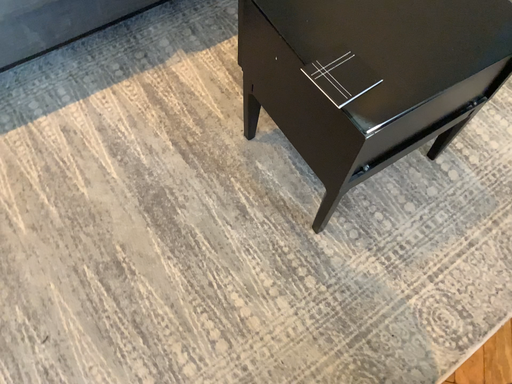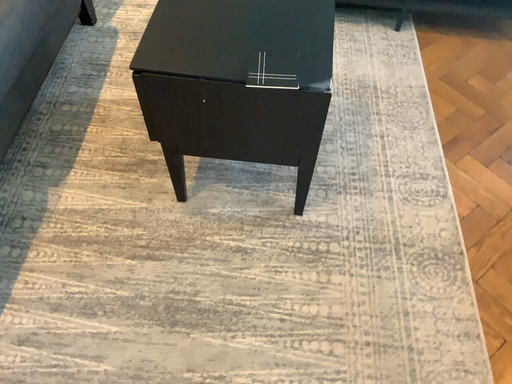
Question: Which way did the camera rotate in the video?

Choices:
 (A) rotated right
 (B) rotated left

Answer: (A)